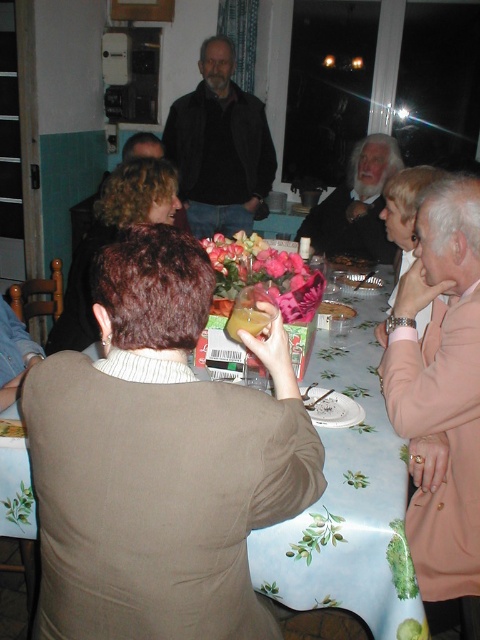
Question: Which object appears closest to the camera in this image?

Choices:
 (A) translucent glass jar at table center
 (B) smooth plastic bowl at center
 (C) light blue fabric tablecloth at center

Answer: (C)

Question: Can you confirm if curly hair at center is smaller than translucent glass jar at table center?

Choices:
 (A) yes
 (B) no

Answer: (B)

Question: Which object is positioned farthest from the smooth plastic bowl at center?

Choices:
 (A) translucent glass jar at table center
 (B) curly hair at center
 (C) light blue fabric tablecloth at center
 (D) white ceramic platter at center

Answer: (D)

Question: Which of the following is the farthest from the observer?

Choices:
 (A) (83, 317)
 (B) (349, 257)

Answer: (B)

Question: Can you confirm if pink fabric jacket at right is bigger than dark brown leather jacket at upper center?

Choices:
 (A) no
 (B) yes

Answer: (A)

Question: Where is black leather jacket at upper center located in relation to curly hair at center in the image?

Choices:
 (A) below
 (B) above

Answer: (B)